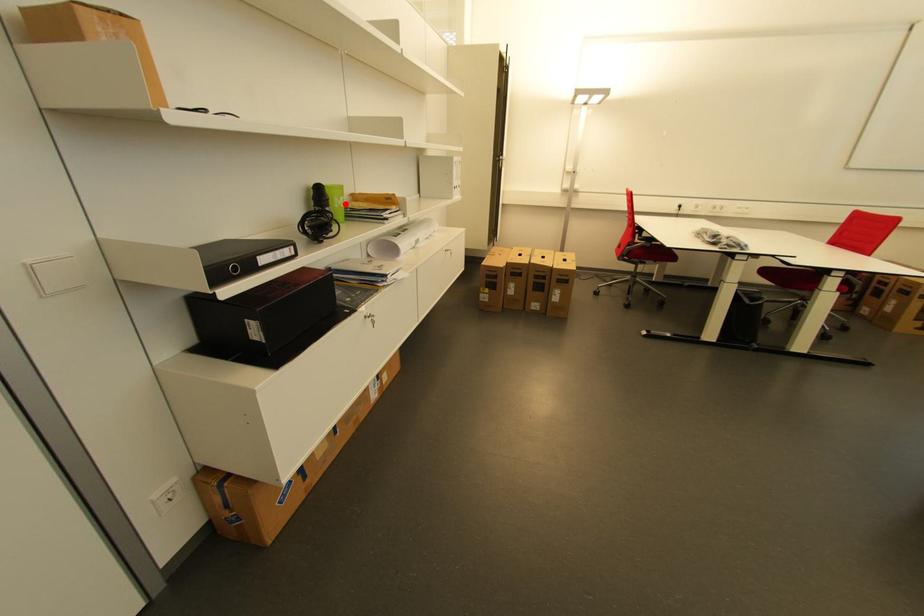
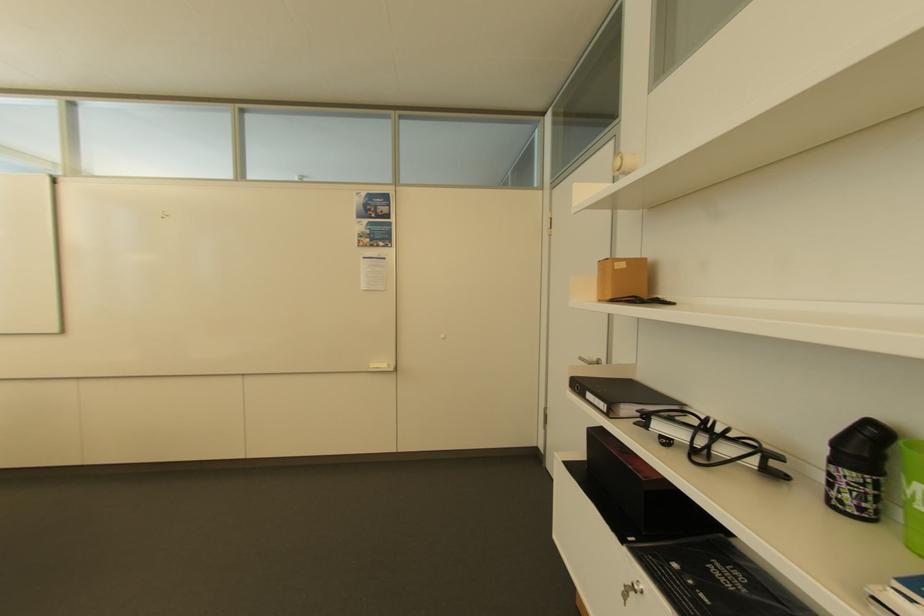
Find the pixel in the second image that matches the highlighted location in the first image.

(916, 493)